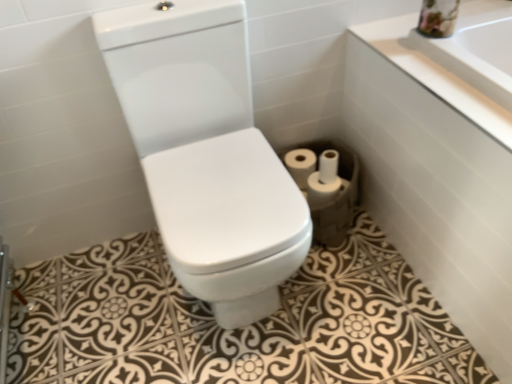
The height and width of the screenshot is (384, 512). Describe the element at coordinates (300, 165) in the screenshot. I see `white matte toilet paper at center, the 1th toilet paper when ordered from left to right` at that location.

At what (x,y) coordinates should I click in order to perform the action: click on white glossy toilet at center. Please return your answer as a coordinate pair (x, y). The image size is (512, 384). Looking at the image, I should click on (206, 153).

The image size is (512, 384). I want to click on white glossy bathtub at lower right, so click(436, 177).

Measure the distance between point (307, 194) and camera.

They are 4.76 feet apart.

At what (x,y) coordinates should I click in order to perform the action: click on white matte toilet paper at center, the 1th toilet paper when ordered from left to right. Please return your answer as a coordinate pair (x, y). Looking at the image, I should click on (300, 165).

Considering the positions of points (197, 136) and (301, 180), is point (197, 136) farther from camera compared to point (301, 180)?

No.

From the image's perspective, is white glossy toilet at center located above white matte toilet paper at center, the 4th toilet paper in the right-to-left sequence?

No.

Is white matte toilet paper at center, the 4th toilet paper in the right-to-left sequence, to the left of white matte toilet paper at lower right, acting as the 3th toilet paper starting from the left, from the viewer's perspective?

Correct, you'll find white matte toilet paper at center, the 4th toilet paper in the right-to-left sequence, to the left of white matte toilet paper at lower right, acting as the 3th toilet paper starting from the left.

From the image's perspective, who appears lower, white matte toilet paper at center, the 4th toilet paper in the right-to-left sequence, or white matte toilet paper at lower right, acting as the 3th toilet paper starting from the left?

white matte toilet paper at lower right, acting as the 3th toilet paper starting from the left, is shown below in the image.

Between white matte toilet paper at center, the 1th toilet paper when ordered from left to right, and white matte toilet paper at lower right, marked as the 2th toilet paper in a right-to-left arrangement, which one is positioned in front?

white matte toilet paper at lower right, marked as the 2th toilet paper in a right-to-left arrangement, is closer to the camera.

Considering the relative sizes of white matte toilet paper at center, the 1th toilet paper when ordered from left to right, and white matte toilet paper at lower right, marked as the 2th toilet paper in a right-to-left arrangement, in the image provided, is white matte toilet paper at center, the 1th toilet paper when ordered from left to right, bigger than white matte toilet paper at lower right, marked as the 2th toilet paper in a right-to-left arrangement,?

Indeed, white matte toilet paper at center, the 1th toilet paper when ordered from left to right, has a larger size compared to white matte toilet paper at lower right, marked as the 2th toilet paper in a right-to-left arrangement.

Who is taller, white matte toilet paper at center, the 1th toilet paper when ordered from left to right, or white glossy bathtub at lower right?

With more height is white glossy bathtub at lower right.

Which is behind, point (313, 153) or point (421, 119)?

Positioned behind is point (313, 153).

Is white glossy bathtub at lower right located within white matte toilet paper at center, the 1th toilet paper when ordered from left to right?

No, white glossy bathtub at lower right is not surrounded by white matte toilet paper at center, the 1th toilet paper when ordered from left to right.

Between white matte toilet paper at center, the 4th toilet paper in the right-to-left sequence, and white glossy bathtub at lower right, which one has larger width?

white glossy bathtub at lower right is wider.

Is point (317, 202) behind point (343, 190)?

No, (317, 202) is closer to viewer.

From the picture: Is white matte toilet paper at center, marked as the fourth toilet paper in a left-to-right arrangement, completely or partially inside white matte toilet paper at lower right, arranged as the 2th toilet paper when viewed from the left?

No, white matte toilet paper at center, marked as the fourth toilet paper in a left-to-right arrangement, is not inside white matte toilet paper at lower right, arranged as the 2th toilet paper when viewed from the left.

From a real-world perspective, which is physically above, white matte toilet paper at lower right, arranged as the 2th toilet paper when viewed from the left, or white matte toilet paper at center, marked as the fourth toilet paper in a left-to-right arrangement?

white matte toilet paper at lower right, arranged as the 2th toilet paper when viewed from the left.

Is white matte toilet paper at lower right, the third toilet paper in the right-to-left sequence, at the back of white glossy toilet at center?

That's not correct — white glossy toilet at center is not looking away from white matte toilet paper at lower right, the third toilet paper in the right-to-left sequence.

In the image, is white glossy toilet at center positioned in front of or behind white matte toilet paper at lower right, the third toilet paper in the right-to-left sequence?

Clearly, white glossy toilet at center is in front of white matte toilet paper at lower right, the third toilet paper in the right-to-left sequence.

From a real-world perspective, does white glossy toilet at center sit lower than white matte toilet paper at lower right, arranged as the 2th toilet paper when viewed from the left?

Actually, white glossy toilet at center is physically above white matte toilet paper at lower right, arranged as the 2th toilet paper when viewed from the left, in the real world.

Which object is positioned more to the right, white glossy toilet at center or white matte toilet paper at lower right, the third toilet paper in the right-to-left sequence?

white matte toilet paper at lower right, the third toilet paper in the right-to-left sequence, is more to the right.

Would you say white glossy bathtub at lower right is outside white matte toilet paper at center, marked as the fourth toilet paper in a left-to-right arrangement?

white glossy bathtub at lower right is positioned outside white matte toilet paper at center, marked as the fourth toilet paper in a left-to-right arrangement.

Which object is positioned more to the left, white glossy bathtub at lower right or white matte toilet paper at center, which is counted as the 1th toilet paper, starting from the right?

Positioned to the left is white matte toilet paper at center, which is counted as the 1th toilet paper, starting from the right.

From a real-world perspective, is white glossy bathtub at lower right above or below white matte toilet paper at center, which is counted as the 1th toilet paper, starting from the right?

In terms of real-world spatial position, white glossy bathtub at lower right is above white matte toilet paper at center, which is counted as the 1th toilet paper, starting from the right.

Is point (338, 188) farther from viewer compared to point (306, 159)?

That is False.

Locate an element on the screen. The width and height of the screenshot is (512, 384). toilet paper that is the 1st object to the right of the white matte toilet paper at center, the 1th toilet paper when ordered from left to right, starting at the anchor is located at coordinates (x=321, y=190).

From a real-world perspective, is white matte toilet paper at lower right, the third toilet paper in the right-to-left sequence, physically located above or below white matte toilet paper at center, the 4th toilet paper in the right-to-left sequence?

In terms of real-world spatial position, white matte toilet paper at lower right, the third toilet paper in the right-to-left sequence, is above white matte toilet paper at center, the 4th toilet paper in the right-to-left sequence.

The width and height of the screenshot is (512, 384). I want to click on the 1st toilet paper to the right of the white glossy toilet at center, counting from the anchor's position, so click(300, 165).

At what (x,y) coordinates should I click in order to perform the action: click on the 2nd toilet paper behind the white matte toilet paper at lower right, marked as the 2th toilet paper in a right-to-left arrangement. Please return your answer as a coordinate pair (x, y). The image size is (512, 384). Looking at the image, I should click on click(300, 165).

From the image, which object appears to be farther from white glossy toilet at center, white matte toilet paper at lower right, acting as the 3th toilet paper starting from the left, or white matte toilet paper at center, marked as the fourth toilet paper in a left-to-right arrangement?

The object further to white glossy toilet at center is white matte toilet paper at lower right, acting as the 3th toilet paper starting from the left.

Which object lies nearer to the anchor point white matte toilet paper at center, the 4th toilet paper in the right-to-left sequence, white matte toilet paper at center, marked as the fourth toilet paper in a left-to-right arrangement, or white matte toilet paper at lower right, arranged as the 2th toilet paper when viewed from the left?

Based on the image, white matte toilet paper at lower right, arranged as the 2th toilet paper when viewed from the left, appears to be nearer to white matte toilet paper at center, the 4th toilet paper in the right-to-left sequence.

Looking at the image, which one is located closer to white glossy bathtub at lower right, white matte toilet paper at center, marked as the fourth toilet paper in a left-to-right arrangement, or white matte toilet paper at center, the 1th toilet paper when ordered from left to right?

white matte toilet paper at center, marked as the fourth toilet paper in a left-to-right arrangement.

Based on their spatial positions, is white matte toilet paper at center, which is counted as the 1th toilet paper, starting from the right, or white matte toilet paper at center, the 4th toilet paper in the right-to-left sequence, closer to white glossy toilet at center?

white matte toilet paper at center, which is counted as the 1th toilet paper, starting from the right, lies closer to white glossy toilet at center than the other object.

From the image, which object appears to be farther from white glossy toilet at center, white matte toilet paper at center, the 4th toilet paper in the right-to-left sequence, or white matte toilet paper at lower right, arranged as the 2th toilet paper when viewed from the left?

Among the two, white matte toilet paper at center, the 4th toilet paper in the right-to-left sequence, is located further to white glossy toilet at center.

Based on their spatial positions, is white matte toilet paper at lower right, arranged as the 2th toilet paper when viewed from the left, or white glossy toilet at center closer to white matte toilet paper at center, the 1th toilet paper when ordered from left to right?

Based on the image, white matte toilet paper at lower right, arranged as the 2th toilet paper when viewed from the left, appears to be nearer to white matte toilet paper at center, the 1th toilet paper when ordered from left to right.

Considering their positions, is white glossy bathtub at lower right positioned closer to white glossy toilet at center than white matte toilet paper at center, which is counted as the 1th toilet paper, starting from the right?

Based on the image, white matte toilet paper at center, which is counted as the 1th toilet paper, starting from the right, appears to be nearer to white glossy toilet at center.

Which object lies further to the anchor point white glossy toilet at center, white matte toilet paper at lower right, the third toilet paper in the right-to-left sequence, or white matte toilet paper at lower right, acting as the 3th toilet paper starting from the left?

white matte toilet paper at lower right, acting as the 3th toilet paper starting from the left, is further to white glossy toilet at center.

This screenshot has height=384, width=512. In order to click on toilet paper between white matte toilet paper at lower right, marked as the 2th toilet paper in a right-to-left arrangement, and white matte toilet paper at lower right, the third toilet paper in the right-to-left sequence, from top to bottom in this screenshot , I will do `click(326, 186)`.

Identify the location of bath located between white glossy toilet at center and white matte toilet paper at center, the 4th toilet paper in the right-to-left sequence, in the depth direction. The width and height of the screenshot is (512, 384). (436, 177).

Where is `bath positioned between white glossy toilet at center and white matte toilet paper at lower right, acting as the 3th toilet paper starting from the left, from near to far`? The width and height of the screenshot is (512, 384). bath positioned between white glossy toilet at center and white matte toilet paper at lower right, acting as the 3th toilet paper starting from the left, from near to far is located at coordinates (436, 177).

I want to click on toilet paper between white glossy bathtub at lower right and white matte toilet paper at lower right, marked as the 2th toilet paper in a right-to-left arrangement, in the front-back direction, so click(326, 186).